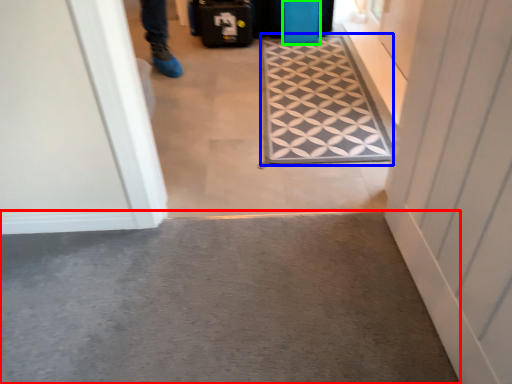
Question: Estimate the real-world distances between objects in this image. Which object is closer to concrete (highlighted by a red box), doormat (highlighted by a blue box) or luggage (highlighted by a green box)?

Choices:
 (A) doormat
 (B) luggage

Answer: (A)